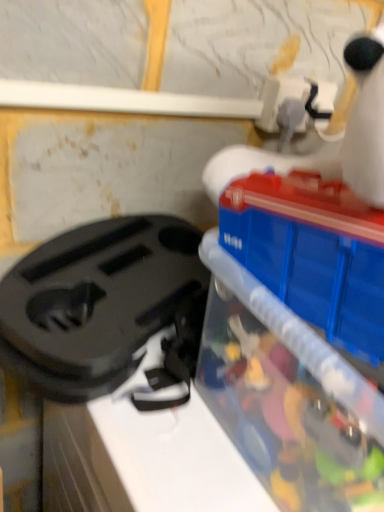
Question: Is black plastic bag at left taller than translucent plastic container at right?

Choices:
 (A) yes
 (B) no

Answer: (B)

Question: Does black plastic bag at left have a smaller size compared to translucent plastic container at right?

Choices:
 (A) yes
 (B) no

Answer: (A)

Question: From the image's perspective, is black plastic bag at left above translucent plastic container at right?

Choices:
 (A) yes
 (B) no

Answer: (A)

Question: From a real-world perspective, is black plastic bag at left located higher than translucent plastic container at right?

Choices:
 (A) yes
 (B) no

Answer: (B)

Question: Is black plastic bag at left oriented away from translucent plastic container at right?

Choices:
 (A) no
 (B) yes

Answer: (A)

Question: Can you confirm if black plastic bag at left is positioned to the left of translucent plastic container at right?

Choices:
 (A) yes
 (B) no

Answer: (A)

Question: Can you confirm if translucent plastic container at right is shorter than black plastic bag at left?

Choices:
 (A) no
 (B) yes

Answer: (A)

Question: Could you tell me if translucent plastic container at right is turned towards black plastic bag at left?

Choices:
 (A) no
 (B) yes

Answer: (A)

Question: Can you confirm if translucent plastic container at right is taller than black plastic bag at left?

Choices:
 (A) no
 (B) yes

Answer: (B)

Question: From the image's perspective, does translucent plastic container at right appear higher than black plastic bag at left?

Choices:
 (A) yes
 (B) no

Answer: (B)

Question: From a real-world perspective, is translucent plastic container at right located higher than black plastic bag at left?

Choices:
 (A) no
 (B) yes

Answer: (B)

Question: Can you confirm if translucent plastic container at right is positioned to the left of black plastic bag at left?

Choices:
 (A) no
 (B) yes

Answer: (A)

Question: Considering the positions of black plastic bag at left and translucent plastic container at right in the image, is black plastic bag at left taller or shorter than translucent plastic container at right?

Choices:
 (A) short
 (B) tall

Answer: (A)